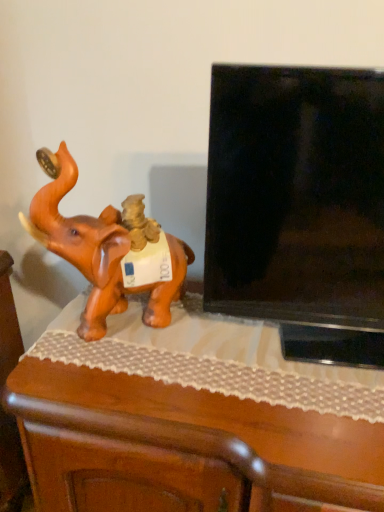
The width and height of the screenshot is (384, 512). Find the location of `vacant space in front of orange matte elephant at left`. vacant space in front of orange matte elephant at left is located at coordinates (115, 377).